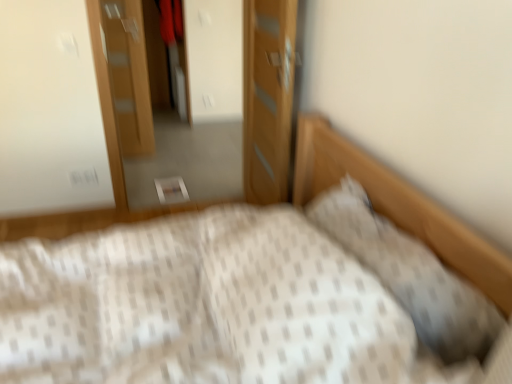
The width and height of the screenshot is (512, 384). Find the location of `wooden door at center, the 2th door from the left`. wooden door at center, the 2th door from the left is located at coordinates (268, 97).

In order to click on wooden door at upper left, which appears as the first door when viewed from the back in this screenshot , I will do `click(128, 74)`.

From a real-world perspective, which is physically above, wooden door at center, which is the 2th door in back-to-front order, or white textured bed at center?

wooden door at center, which is the 2th door in back-to-front order, is physically above.

Considering their positions, is wooden door at center, which ranks as the first door in right-to-left order, located in front of or behind white textured bed at center?

wooden door at center, which ranks as the first door in right-to-left order, is behind white textured bed at center.

Which of these two, wooden door at center, which ranks as the first door in right-to-left order, or white textured bed at center, is bigger?

white textured bed at center is bigger.

Does point (106, 131) appear closer or farther from the camera than point (402, 225)?

Point (106, 131) is farther from the camera than point (402, 225).

Would you say white textured bed at center is part of wooden dresser at center's contents?

Definitely not — white textured bed at center is not inside wooden dresser at center.

How different are the orientations of wooden dresser at center and white textured bed at center in degrees?

90.4 degrees separate the facing orientations of wooden dresser at center and white textured bed at center.

Does wooden door at center, which appears as the first door when viewed from the front, turn towards white textured pillow at upper right?

No, wooden door at center, which appears as the first door when viewed from the front, is not turned towards white textured pillow at upper right.

Which is behind, point (281, 172) or point (446, 335)?

Point (281, 172)

Does wooden door at center, which appears as the first door when viewed from the front, come in front of white textured pillow at upper right?

No, it is behind white textured pillow at upper right.

Is wooden door at center, which is the 2th door in back-to-front order, surrounding white textured pillow at upper right?

That's incorrect, white textured pillow at upper right is not inside wooden door at center, which is the 2th door in back-to-front order.

Is there a large distance between white textured pillow at upper right and wooden door at center, which appears as the first door when viewed from the front?

white textured pillow at upper right is far away from wooden door at center, which appears as the first door when viewed from the front.

From the image's perspective, is white textured pillow at upper right beneath wooden door at center, which ranks as the first door in right-to-left order?

Indeed, from the image's perspective, white textured pillow at upper right is shown beneath wooden door at center, which ranks as the first door in right-to-left order.

Considering the positions of points (308, 212) and (259, 1), is point (308, 212) farther from camera compared to point (259, 1)?

No, it is not.

From the picture: Does white textured bed at center have a lesser height compared to wooden dresser at center?

Correct, white textured bed at center is not as tall as wooden dresser at center.

Considering the sizes of objects white textured bed at center and wooden dresser at center in the image provided, who is wider, white textured bed at center or wooden dresser at center?

Wider between the two is white textured bed at center.

At what (x,y) coordinates should I click in order to perform the action: click on bed on the right of wooden dresser at center. Please return your answer as a coordinate pair (x, y). Looking at the image, I should click on (209, 307).

Is white textured bed at center spatially inside wooden door at upper left, the second door viewed from the right, or outside of it?

white textured bed at center is not enclosed by wooden door at upper left, the second door viewed from the right.

From the image's perspective, which one is positioned lower, white textured bed at center or wooden door at upper left, which appears as the first door when viewed from the back?

white textured bed at center is shown below in the image.

Looking at this image, does white textured bed at center touch wooden door at upper left, which appears as the first door when viewed from the back?

No, white textured bed at center is not with wooden door at upper left, which appears as the first door when viewed from the back.

Is there a large distance between wooden door at upper left, the second door viewed from the right, and white textured bed at center?

That's right, there is a large distance between wooden door at upper left, the second door viewed from the right, and white textured bed at center.

Is wooden door at upper left, arranged as the 2th door when viewed from the front, oriented towards white textured bed at center?

Yes, wooden door at upper left, arranged as the 2th door when viewed from the front, is aimed at white textured bed at center.

Is wooden door at upper left, arranged as the 2th door when viewed from the front, located outside white textured bed at center?

wooden door at upper left, arranged as the 2th door when viewed from the front, is positioned outside white textured bed at center.

Does wooden door at upper left, acting as the 1th door starting from the left, have a larger size compared to white textured bed at center?

Incorrect, wooden door at upper left, acting as the 1th door starting from the left, is not larger than white textured bed at center.

You are a GUI agent. You are given a task and a screenshot of the screen. Output one action in this format:
    pyautogui.click(x=<x>, y=<y>)
    Task: Click on the bed below the wooden door at center, which is the 2th door in back-to-front order (from a real-world perspective)
    
    Given the screenshot: What is the action you would take?
    pyautogui.click(x=209, y=307)

There is a white textured bed at center. What are the coordinates of `dresser above it (from a real-world perspective)` in the screenshot? It's located at (262, 105).

From the picture: Estimate the real-world distances between objects in this image. Which object is closer to white textured pillow at upper right, wooden door at upper left, the second door viewed from the right, or wooden dresser at center?

Among the two, wooden dresser at center is located nearer to white textured pillow at upper right.

Based on their spatial positions, is white textured bed at center or wooden door at upper left, acting as the 1th door starting from the left, further from wooden dresser at center?

white textured bed at center is further to wooden dresser at center.

Estimate the real-world distances between objects in this image. Which object is further from white textured bed at center, wooden door at upper left, acting as the 1th door starting from the left, or wooden dresser at center?

wooden door at upper left, acting as the 1th door starting from the left.

From the image, which object appears to be farther from white textured pillow at upper right, wooden dresser at center or wooden door at center, which ranks as the first door in right-to-left order?

wooden dresser at center lies further to white textured pillow at upper right than the other object.

From the image, which object appears to be farther from wooden door at center, the 2th door from the left, wooden dresser at center or white textured bed at center?

The object further to wooden door at center, the 2th door from the left, is white textured bed at center.

From the image, which object appears to be nearer to white textured pillow at upper right, wooden door at center, which is the 2th door in back-to-front order, or wooden dresser at center?

The object closer to white textured pillow at upper right is wooden door at center, which is the 2th door in back-to-front order.

Based on their spatial positions, is white textured pillow at upper right or wooden door at upper left, the second door viewed from the right, further from white textured bed at center?

wooden door at upper left, the second door viewed from the right, is further to white textured bed at center.

Which object lies further to the anchor point wooden dresser at center, white textured bed at center or white textured pillow at upper right?

white textured pillow at upper right is further to wooden dresser at center.

Identify the location of pillow between white textured bed at center and wooden dresser at center along the z-axis. pyautogui.click(x=410, y=274).

I want to click on door between white textured pillow at upper right and wooden door at upper left, which appears as the first door when viewed from the back, along the z-axis, so click(x=268, y=97).

Where is `door between white textured pillow at upper right and wooden dresser at center from front to back`? door between white textured pillow at upper right and wooden dresser at center from front to back is located at coordinates 268,97.

Where is `pillow between white textured bed at center and wooden door at center, which appears as the first door when viewed from the front, in the front-back direction`? This screenshot has height=384, width=512. pillow between white textured bed at center and wooden door at center, which appears as the first door when viewed from the front, in the front-back direction is located at coordinates (410, 274).